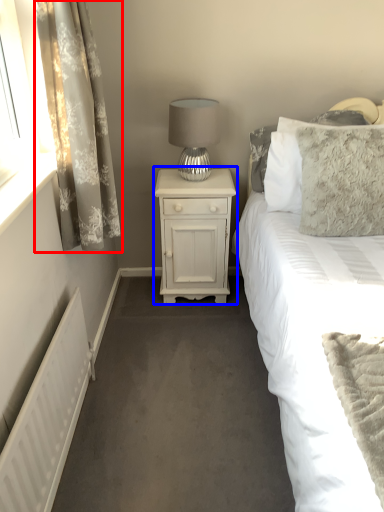
Question: Which object appears closest to the camera in this image, curtain (highlighted by a red box) or nightstand (highlighted by a blue box)?

Choices:
 (A) curtain
 (B) nightstand

Answer: (A)